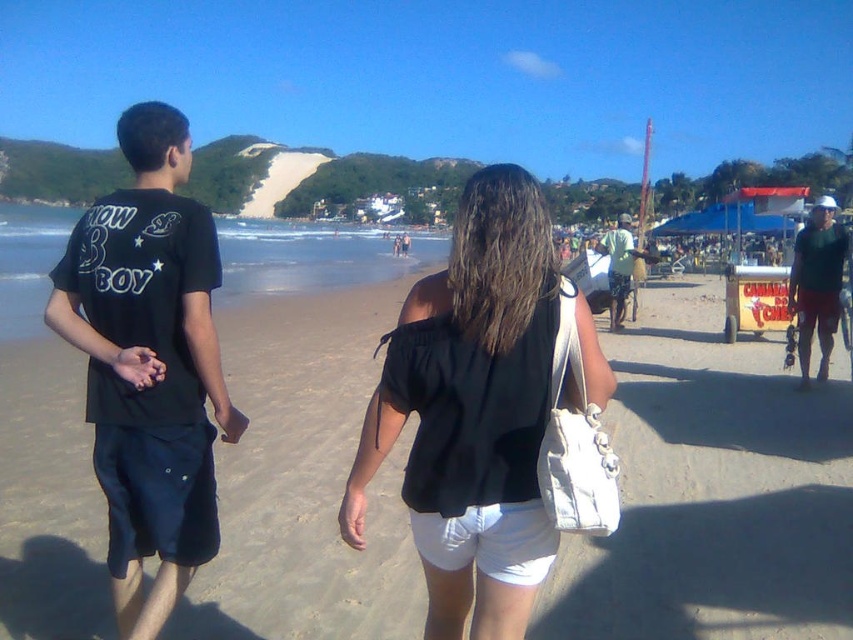
You are standing at the camera position and want to pick up the white fabric bag at center. The camera is 5 feet tall. Can you reach it without bending down?

The white fabric bag at center is 9.69 feet from the camera. Since the camera is 5 feet tall, the bag is at a distance of 9.69 feet horizontally away from the camera. Therefore, you can reach it without bending down as it is within a comfortable reach range.

You are standing at the center of the beach and want to place a new bench. The bench must be placed such that it is exactly halfway between the white fabric bag at center and the ocean. Where should you place the bench?

The bench should be placed halfway between the white fabric bag at center and the ocean. Since the white fabric bag at center is located at point (712, 492), the bench should be placed along the line connecting it to the ocean, exactly halfway between those two points.